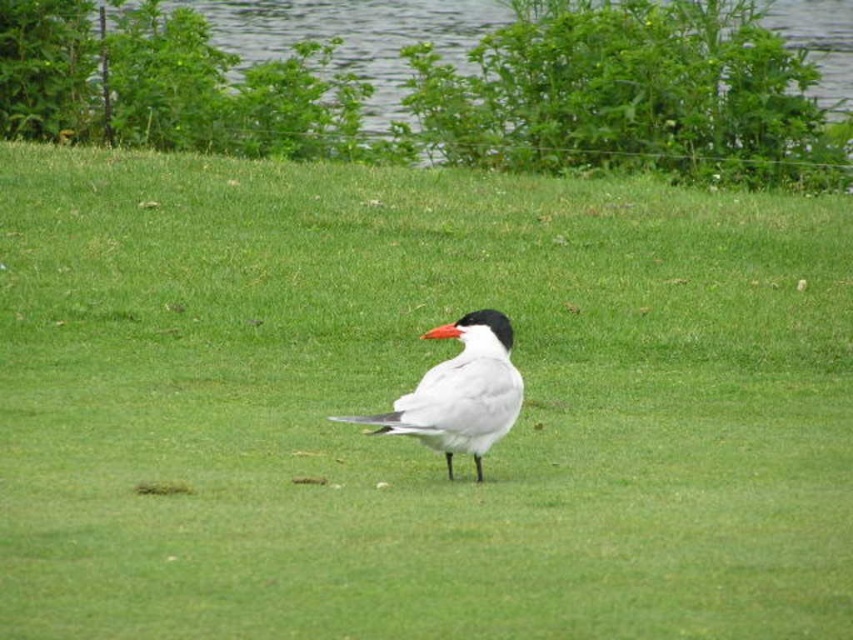
You are a photographer trying to capture the white glossy bird at center. You notice the green grass at upper center might interfere with the background. Which area should you focus on to ensure the bird is the main subject?

The green grass at upper center occupies less space than the white glossy bird at center, so focusing on the area where the white glossy bird at center is located will make it the main subject as it takes up more space in the image.

What are the coordinates of the green grass at upper center?

The green grass at upper center is located at coordinates point (440, 92).